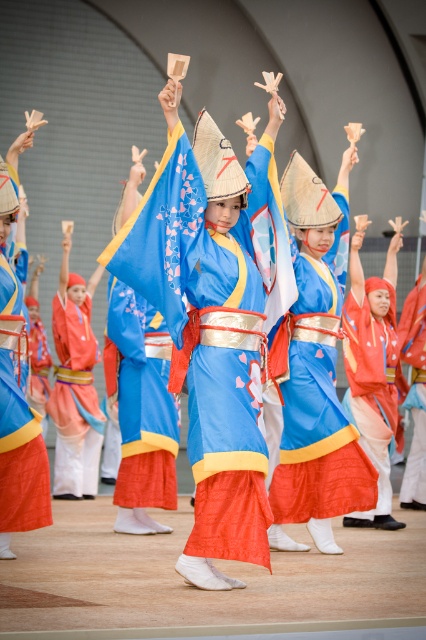
You are a photographer trying to capture the central performer in the scene. You notice two points marked in the image, one at point (x=325, y=342) and another at point (x=25, y=465). Which point should you focus on to ensure the central performer is in the foreground of your photo?

Point (x=25, y=465) should be focused on because it is in front of point (x=325, y=342), ensuring the central performer is in the foreground.

You are a photographer at the cultural event and want to capture the central performer in the foreground without any obstructions. Given the positions of point (74, 451) and point (412, 410), which point should you focus on to ensure the central performer is clearly visible?

Point (74, 451) is in front of point (412, 410), so focusing on point (74, 451) will ensure the central performer is clearly visible without obstruction from the other point.

You are a photographer at the event and want to capture a closeup of the matte blue kimono at center and the matte red fabric kimono at center. Since the camera can only focus on one kimono at a time, which kimono should you choose to ensure the details are clearer in the photo?

The matte blue kimono at center is larger in size compared to the matte red fabric kimono at center. Therefore, the matte blue kimono at center should be chosen for the closeup to ensure the details are clearer in the photo.